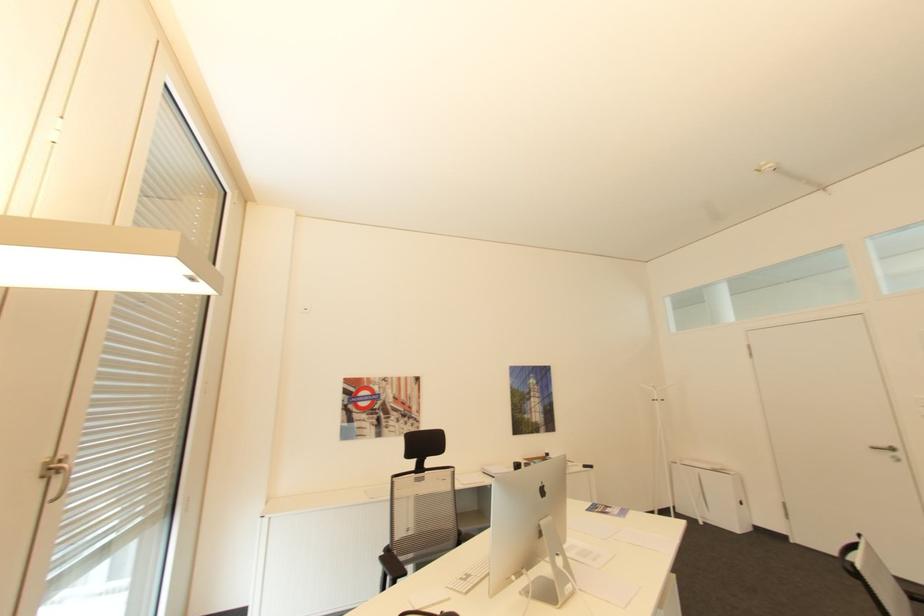
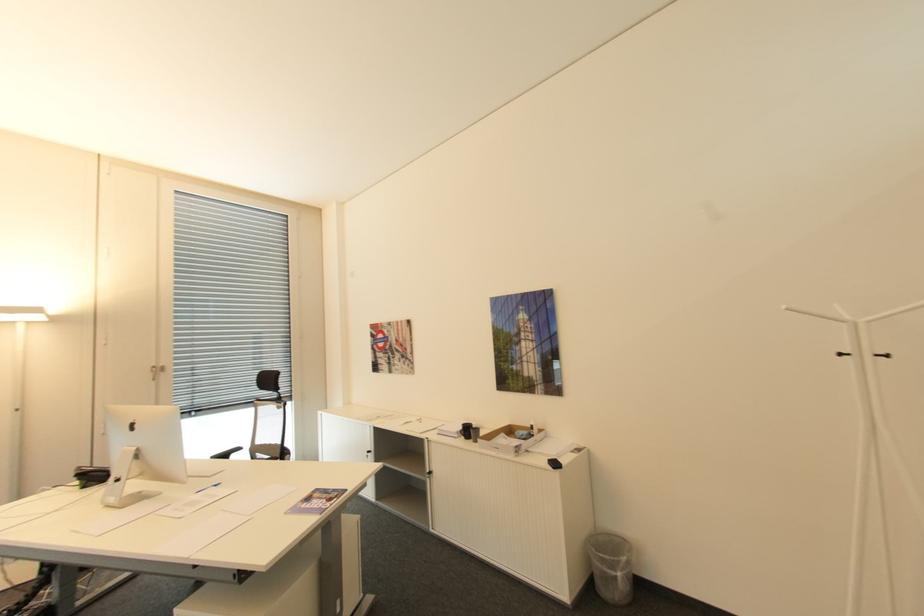
In the second image, find the point that corresponds to point (550, 488) in the first image.

(140, 426)